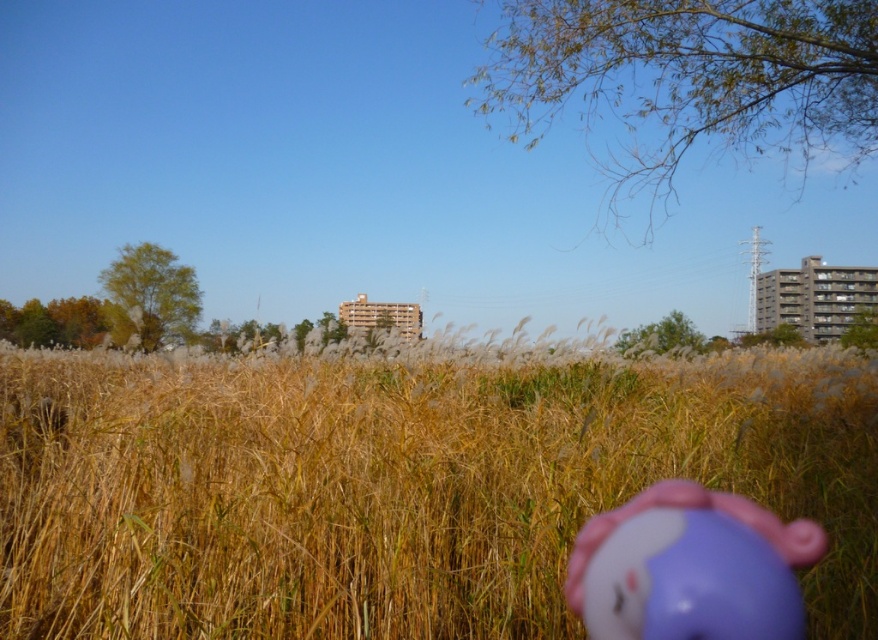
Question: Does yellow dry grass at center appear on the left side of purple matte toy at center?

Choices:
 (A) no
 (B) yes

Answer: (B)

Question: Which point is closer to the camera?

Choices:
 (A) (825, 550)
 (B) (291, 564)

Answer: (A)

Question: Which of the following is the closest to the observer?

Choices:
 (A) (713, 493)
 (B) (457, 525)

Answer: (A)

Question: Can you confirm if yellow dry grass at center is smaller than purple matte toy at center?

Choices:
 (A) no
 (B) yes

Answer: (A)

Question: Is yellow dry grass at center to the right of purple matte toy at center from the viewer's perspective?

Choices:
 (A) yes
 (B) no

Answer: (B)